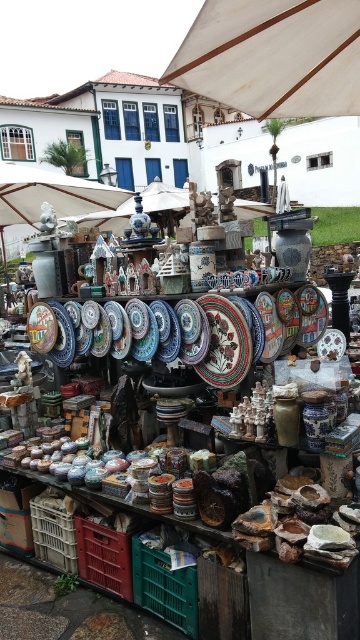
Is white fabric umbrella at upper center further to camera compared to green plastic crate at lower center?

That is True.

Who is more distant from viewer, (36, 188) or (174, 589)?

Positioned behind is point (36, 188).

Is point (79, 193) positioned in front of point (147, 577)?

No.

You are a GUI agent. You are given a task and a screenshot of the screen. Output one action in this format:
    pyautogui.click(x=<x>, y=<y>)
    Task: Click on the white fabric umbrella at upper center
    The width and height of the screenshot is (360, 640).
    Given the screenshot: What is the action you would take?
    pyautogui.click(x=51, y=195)

Who is more forward, (156, 589) or (64, 515)?

Positioned in front is point (156, 589).

Identify the location of green plastic crate at lower center. This screenshot has width=360, height=640. (164, 588).

Between white canvas umbrella at upper center and green plastic crate at lower center, which one has less height?

green plastic crate at lower center

Can you confirm if white canvas umbrella at upper center is shorter than green plastic crate at lower center?

No.

What do you see at coordinates (272, 56) in the screenshot? I see `white canvas umbrella at upper center` at bounding box center [272, 56].

Identify the location of white canvas umbrella at upper center. This screenshot has width=360, height=640. (272, 56).